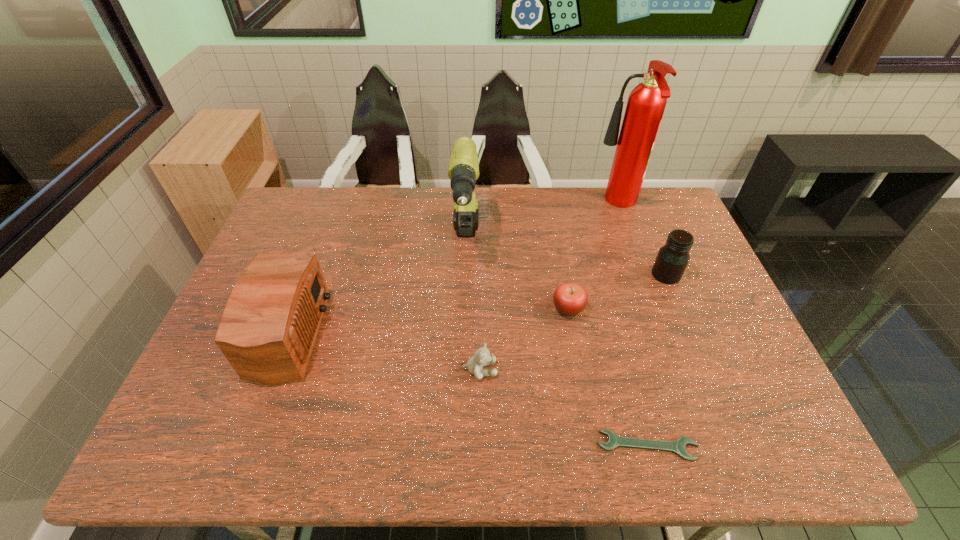
Identify the location of free space located at the nozzle of the tallest object. The height and width of the screenshot is (540, 960). (490, 205).

Locate an element on the screen. vacant position located at the nozzle of the tallest object is located at coordinates (498, 205).

Identify the location of free region located 0.110m on the handle side of the drill. (464, 306).

Where is `free point located 0.140m on the front-facing side of the third tallest object`? free point located 0.140m on the front-facing side of the third tallest object is located at coordinates (379, 334).

Locate an element on the screen. free space located on the left of the fourth tallest object is located at coordinates (535, 274).

Where is `free space located on the right of the apple`? Image resolution: width=960 pixels, height=540 pixels. free space located on the right of the apple is located at coordinates (671, 308).

Locate an element on the screen. This screenshot has height=540, width=960. free location located on the face of the teddy bear is located at coordinates (582, 369).

This screenshot has height=540, width=960. I want to click on vacant space located on the back of the shortest object, so click(x=616, y=333).

Identify the location of fire extinguisher present at the far edge. (646, 103).

This screenshot has height=540, width=960. What are the coordinates of `drill that is at the far edge` in the screenshot? It's located at [463, 171].